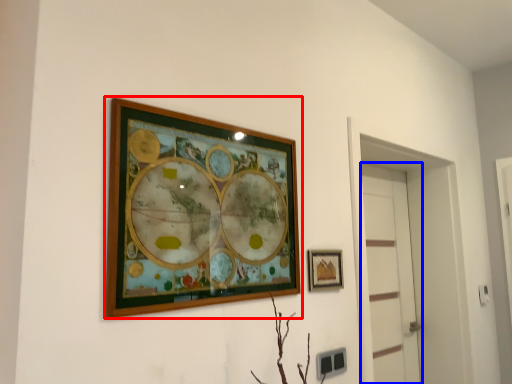
Question: Which point is further to the camera, picture frame (highlighted by a red box) or door (highlighted by a blue box)?

Choices:
 (A) picture frame
 (B) door

Answer: (B)